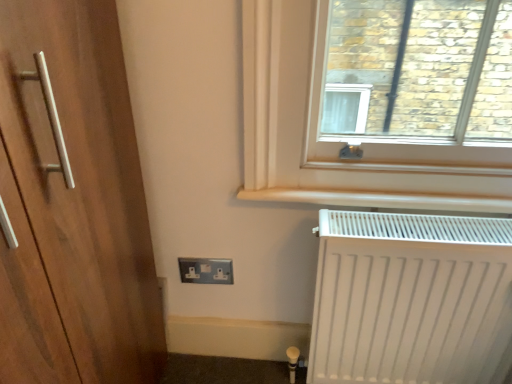
Question: Is white matte radiator at lower right in front of or behind black plastic outlet at lower center in the image?

Choices:
 (A) front
 (B) behind

Answer: (A)

Question: Visually, is white matte radiator at lower right positioned to the left or to the right of black plastic outlet at lower center?

Choices:
 (A) left
 (B) right

Answer: (B)

Question: Is white matte radiator at lower right bigger or smaller than black plastic outlet at lower center?

Choices:
 (A) small
 (B) big

Answer: (B)

Question: From the image's perspective, relative to white matte radiator at lower right, is black plastic outlet at lower center above or below?

Choices:
 (A) below
 (B) above

Answer: (B)

Question: In the image, is black plastic outlet at lower center positioned in front of or behind white matte radiator at lower right?

Choices:
 (A) front
 (B) behind

Answer: (B)

Question: Considering the positions of point (192, 279) and point (395, 322), is point (192, 279) closer or farther from the camera than point (395, 322)?

Choices:
 (A) farther
 (B) closer

Answer: (A)

Question: From a real-world perspective, is black plastic outlet at lower center physically located above or below white matte radiator at lower right?

Choices:
 (A) above
 (B) below

Answer: (B)